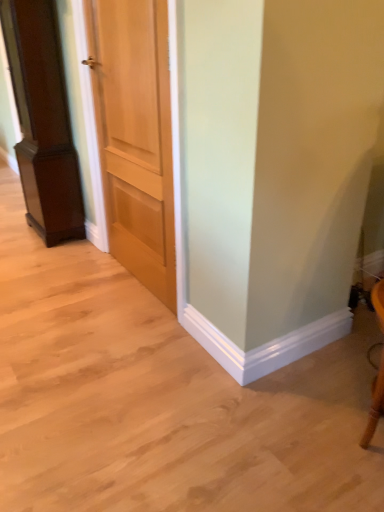
This screenshot has height=512, width=384. In order to click on light brown wood door at center in this screenshot , I will do `click(135, 135)`.

Describe the element at coordinates (135, 135) in the screenshot. The height and width of the screenshot is (512, 384). I see `light brown wood door at center` at that location.

What is the approximate height of light brown wood door at center?

It is 4.06 feet.

What is the approximate width of light brown wood door at center?

The width of light brown wood door at center is 3.84 inches.

I want to click on light brown wood door at center, so 135,135.